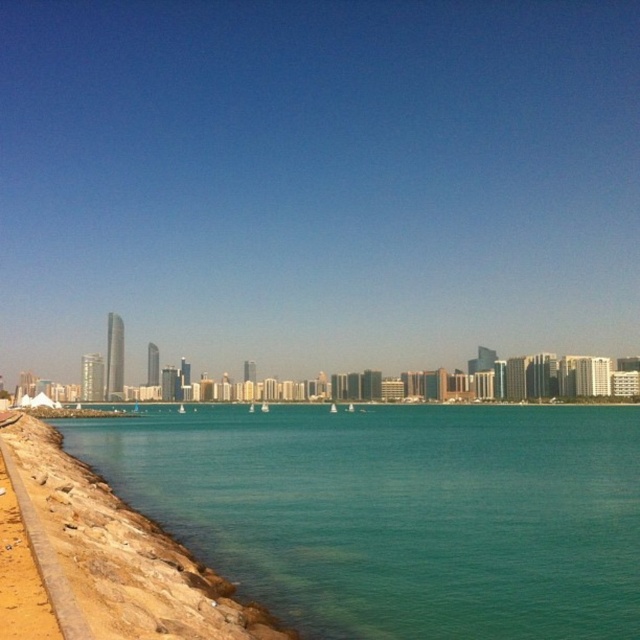
In the scene shown: What are the coordinates of the teal smooth water at lower left in the image?

The coordinates of the teal smooth water at lower left are at point (396, 513).

You are standing on the brown rocky shoreline at lower left and want to reach the teal smooth water at lower left. Which direction should you move to get there?

You should move to the right since the teal smooth water at lower left is located to the right of the brown rocky shoreline at lower left.

You are standing at the shoreline and want to take a photo of the point at coordinates point (632, 419). Given that your camera has a maximum focus range of 150 meters, will you be able to capture it clearly?

The distance of point (632, 419) from the camera is 171.92 meters, which exceeds the camera maximum focus range of 150 meters. Therefore, you won not be able to capture it clearly.